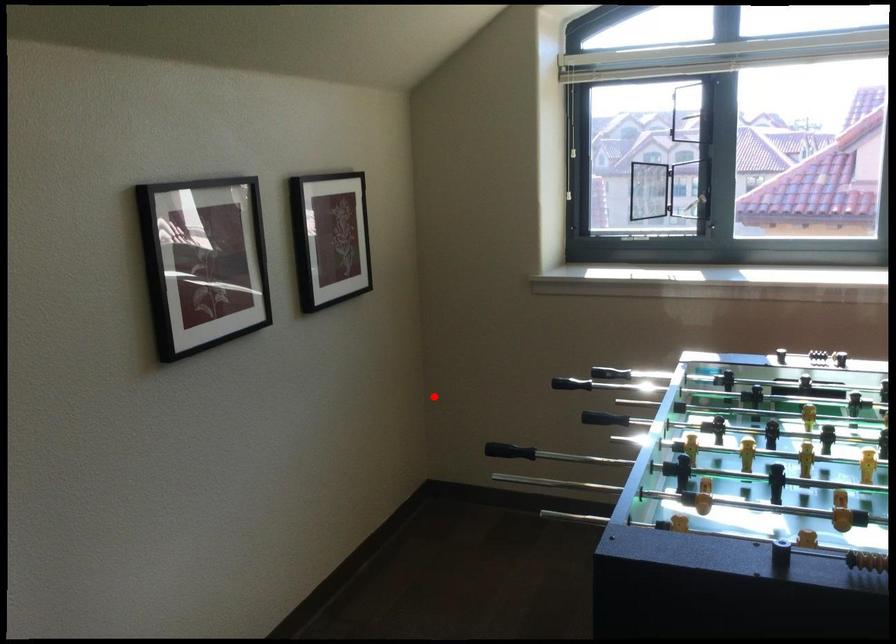
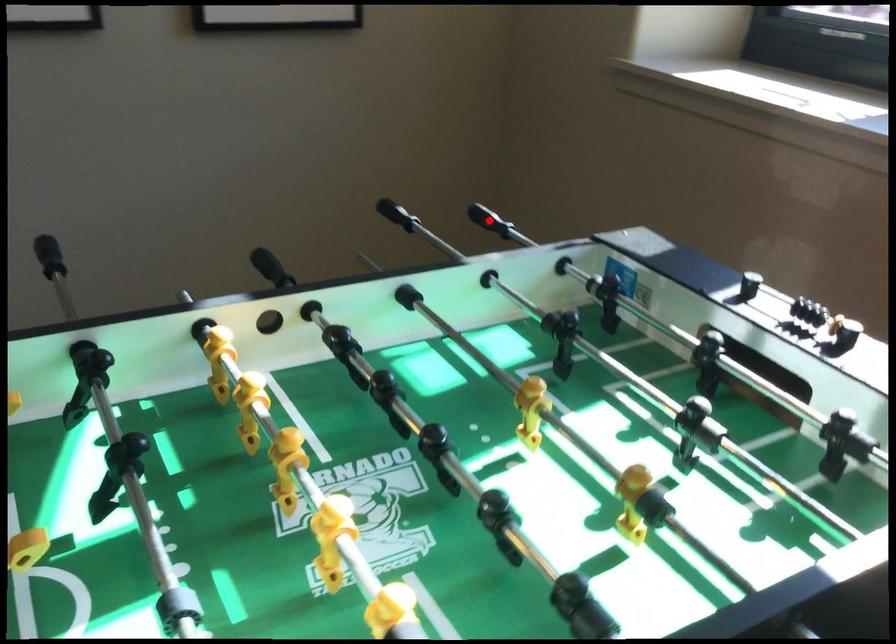
I am providing you with two images of the same scene from different viewpoints. A red point is marked on the first image and another point is marked on the second image. Is the red point in image1 aligned with the point shown in image2?

Yes